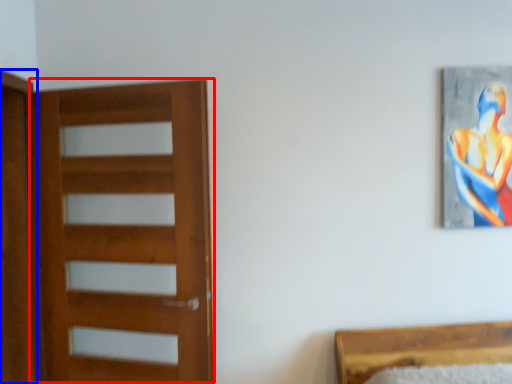
Question: Which object is closer to the camera taking this photo, door (highlighted by a red box) or screen door (highlighted by a blue box)?

Choices:
 (A) door
 (B) screen door

Answer: (A)